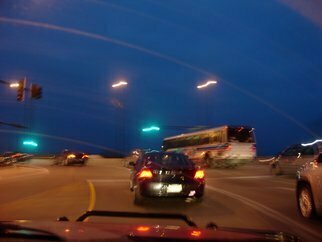
Locate an element on the screen. The height and width of the screenshot is (242, 322). nasty grey stearks on windows is located at coordinates (128, 155), (201, 72).